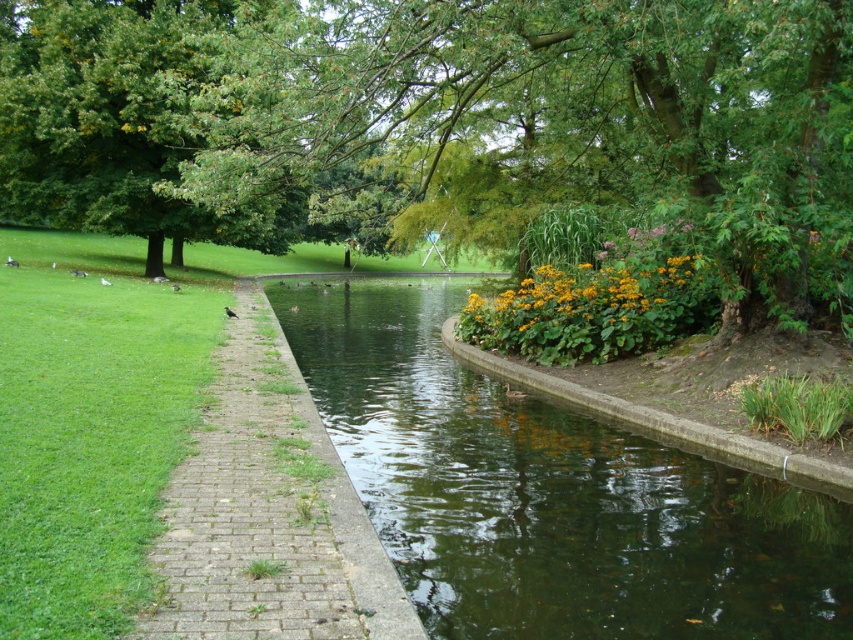
You are standing in the park and want to take a photo of the green leafy tree at upper left. If your camera has a maximum focus range of 20 feet, will you need to move closer to capture it clearly?

The green leafy tree at upper left is 25.08 feet away from the viewer, which exceeds the camera maximum focus range of 20 feet. Therefore, you need to move closer to ensure the tree is within the 20 feet range for clear focus.

You are a park visitor holding a picnic basket and want to place it on the green leafy tree at upper left or the greenish water at center. Which location is physically possible to place the picnic basket?

The greenish water at center is not a solid surface, so you cannot place the picnic basket there. The green leafy tree at upper left is a solid object and can hold the picnic basket.